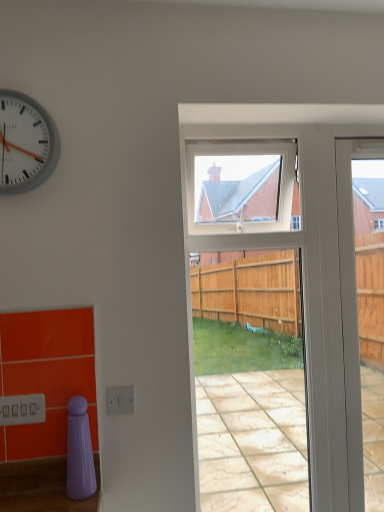
Describe the element at coordinates (311, 264) in the screenshot. The image size is (384, 512). I see `clear glass screen door at center` at that location.

What do you see at coordinates (351, 308) in the screenshot? The width and height of the screenshot is (384, 512). I see `white glossy door at right` at bounding box center [351, 308].

The height and width of the screenshot is (512, 384). What do you see at coordinates (25, 143) in the screenshot?
I see `white plastic clock at upper left` at bounding box center [25, 143].

I want to click on clear glass screen door at center, so click(x=311, y=264).

Considering the relative sizes of white plastic clock at upper left and clear glass screen door at center in the image provided, is white plastic clock at upper left thinner than clear glass screen door at center?

Yes.

Is white plastic clock at upper left not near clear glass screen door at center?

No, white plastic clock at upper left is not far away from clear glass screen door at center.

You are a GUI agent. You are given a task and a screenshot of the screen. Output one action in this format:
    pyautogui.click(x=<x>, y=<y>)
    Task: Click on the clock that is on the left side of clear glass screen door at center
    The image size is (384, 512).
    Given the screenshot: What is the action you would take?
    pyautogui.click(x=25, y=143)

Is white plastic clock at upper left taller or shorter than clear glass screen door at center?

white plastic clock at upper left is shorter than clear glass screen door at center.

Does white plastic clock at upper left turn towards white glossy door at right?

No.

Is white plastic clock at upper left in front of or behind white glossy door at right in the image?

Visually, white plastic clock at upper left is located in front of white glossy door at right.

Is white plastic clock at upper left bigger or smaller than white glossy door at right?

Clearly, white plastic clock at upper left is smaller in size than white glossy door at right.

Which of these two, white plastic clock at upper left or white glossy door at right, is thinner?

white glossy door at right is thinner.

What's the angular difference between clear glass screen door at center and white glossy door at right's facing directions?

The angular difference between clear glass screen door at center and white glossy door at right is 0.0106 degrees.

From a real-world perspective, is clear glass screen door at center beneath white glossy door at right?

Yes, from a real-world perspective, clear glass screen door at center is under white glossy door at right.

Does clear glass screen door at center have a greater width compared to white glossy door at right?

Yes, clear glass screen door at center is wider than white glossy door at right.

Considering the sizes of objects clear glass screen door at center and white glossy door at right in the image provided, who is smaller, clear glass screen door at center or white glossy door at right?

white glossy door at right is smaller.

In terms of height, does white glossy door at right look taller or shorter compared to white plastic clock at upper left?

Clearly, white glossy door at right is taller compared to white plastic clock at upper left.

This screenshot has width=384, height=512. I want to click on clock that appears in front of the white glossy door at right, so click(25, 143).

From a real-world perspective, is white glossy door at right positioned under white plastic clock at upper left based on gravity?

Yes, from a real-world perspective, white glossy door at right is under white plastic clock at upper left.

Is point (349, 380) in front of point (34, 164)?

No, it is behind (34, 164).

How many degrees apart are the facing directions of white glossy door at right and clear glass screen door at center?

0.0106 degrees separate the facing orientations of white glossy door at right and clear glass screen door at center.

Is white glossy door at right spatially inside clear glass screen door at center, or outside of it?

The correct answer is: outside.

Which is more to the left, white glossy door at right or clear glass screen door at center?

clear glass screen door at center.

Does white glossy door at right have a greater height compared to clear glass screen door at center?

Incorrect, the height of white glossy door at right is not larger of that of clear glass screen door at center.

Between clear glass screen door at center and white plastic clock at upper left, which one has smaller size?

white plastic clock at upper left.

Which object is positioned more to the right, clear glass screen door at center or white plastic clock at upper left?

clear glass screen door at center is more to the right.

Could you tell me if clear glass screen door at center is turned towards white plastic clock at upper left?

No, clear glass screen door at center is not oriented towards white plastic clock at upper left.

Can you confirm if clear glass screen door at center is shorter than white plastic clock at upper left?

Incorrect, the height of clear glass screen door at center does not fall short of that of white plastic clock at upper left.

What are the coordinates of `clock above the clear glass screen door at center (from a real-world perspective)` in the screenshot? It's located at (25, 143).

The image size is (384, 512). Find the location of `clock above the white glossy door at right (from the image's perspective)`. clock above the white glossy door at right (from the image's perspective) is located at coordinates (25, 143).

When comparing their distances from clear glass screen door at center, does white plastic clock at upper left or white glossy door at right seem closer?

white glossy door at right lies closer to clear glass screen door at center than the other object.

Looking at the image, which one is located closer to clear glass screen door at center, white glossy door at right or white plastic clock at upper left?

white glossy door at right lies closer to clear glass screen door at center than the other object.

From the image, which object appears to be farther from white glossy door at right, clear glass screen door at center or white plastic clock at upper left?

Among the two, white plastic clock at upper left is located further to white glossy door at right.

When comparing their distances from white plastic clock at upper left, does white glossy door at right or clear glass screen door at center seem closer?

Among the two, clear glass screen door at center is located nearer to white plastic clock at upper left.

Considering their positions, is clear glass screen door at center positioned further to white plastic clock at upper left than white glossy door at right?

white glossy door at right is positioned further to the anchor white plastic clock at upper left.

From the image, which object appears to be farther from white glossy door at right, white plastic clock at upper left or clear glass screen door at center?

Among the two, white plastic clock at upper left is located further to white glossy door at right.

Locate an element on the screen. Image resolution: width=384 pixels, height=512 pixels. screen door between white plastic clock at upper left and white glossy door at right from left to right is located at coordinates click(x=311, y=264).